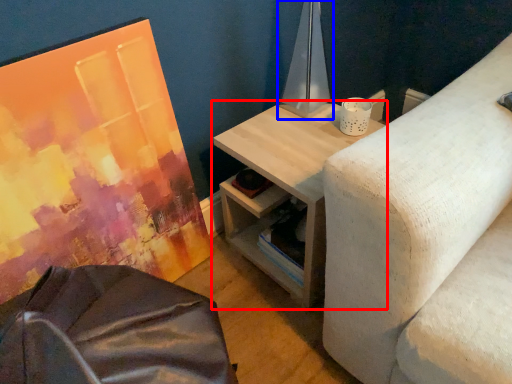
Question: Which object appears closest to the camera in this image, table (highlighted by a red box) or table lamp (highlighted by a blue box)?

Choices:
 (A) table
 (B) table lamp

Answer: (A)